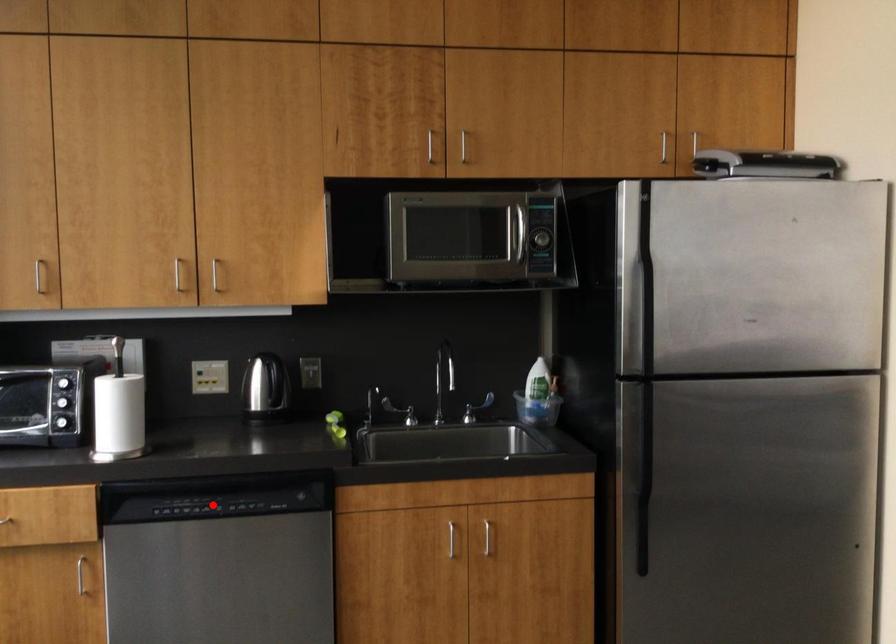
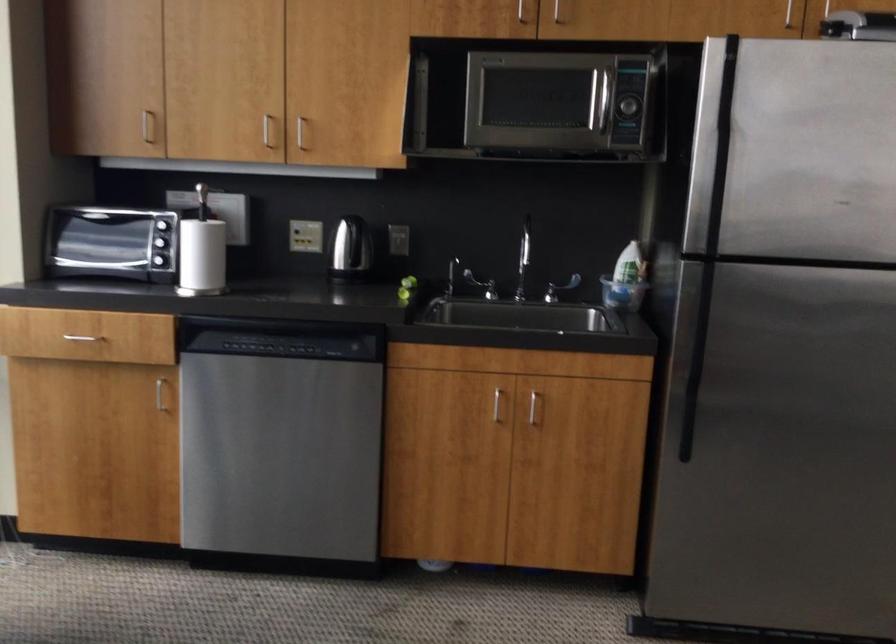
Find the pixel in the second image that matches the highlighted location in the first image.

(277, 346)